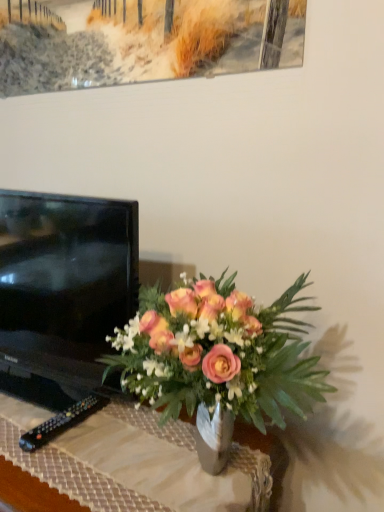
This screenshot has width=384, height=512. I want to click on unoccupied region to the right of black plastic remote at lower left, so click(x=125, y=437).